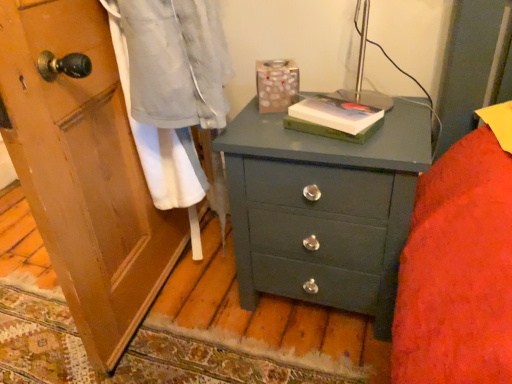
Question: Can you confirm if hardcover book at center, which is the 2th book from bottom to top, is positioned to the left of hardcover book at center, marked as the second book in a top-to-bottom arrangement?

Choices:
 (A) yes
 (B) no

Answer: (B)

Question: Can you see hardcover book at center, which is the 2th book from bottom to top, touching hardcover book at center, marked as the second book in a top-to-bottom arrangement?

Choices:
 (A) yes
 (B) no

Answer: (A)

Question: Is hardcover book at center, acting as the 1th book starting from the top, positioned with its back to hardcover book at center, marked as the 1th book in a bottom-to-top arrangement?

Choices:
 (A) no
 (B) yes

Answer: (A)

Question: Considering the relative sizes of hardcover book at center, acting as the 1th book starting from the top, and hardcover book at center, marked as the 1th book in a bottom-to-top arrangement, in the image provided, is hardcover book at center, acting as the 1th book starting from the top, smaller than hardcover book at center, marked as the 1th book in a bottom-to-top arrangement,?

Choices:
 (A) yes
 (B) no

Answer: (A)

Question: Is hardcover book at center, acting as the 1th book starting from the top, positioned behind hardcover book at center, marked as the 1th book in a bottom-to-top arrangement?

Choices:
 (A) yes
 (B) no

Answer: (B)

Question: Considering the positions of hardcover book at center, acting as the 1th book starting from the top, and matte green chest of drawers at center in the image, is hardcover book at center, acting as the 1th book starting from the top, taller or shorter than matte green chest of drawers at center?

Choices:
 (A) short
 (B) tall

Answer: (A)

Question: In the image, is hardcover book at center, which is the 2th book from bottom to top, positioned in front of or behind matte green chest of drawers at center?

Choices:
 (A) behind
 (B) front

Answer: (A)

Question: Does point (331, 114) appear closer or farther from the camera than point (386, 210)?

Choices:
 (A) closer
 (B) farther

Answer: (A)

Question: From the image's perspective, relative to matte green chest of drawers at center, is hardcover book at center, acting as the 1th book starting from the top, above or below?

Choices:
 (A) above
 (B) below

Answer: (A)

Question: From a real-world perspective, is matte green chest of drawers at center positioned above or below hardcover book at center, marked as the second book in a top-to-bottom arrangement?

Choices:
 (A) above
 (B) below

Answer: (B)

Question: Is matte green chest of drawers at center spatially inside hardcover book at center, marked as the second book in a top-to-bottom arrangement, or outside of it?

Choices:
 (A) outside
 (B) inside

Answer: (A)

Question: Considering the positions of matte green chest of drawers at center and hardcover book at center, marked as the second book in a top-to-bottom arrangement, in the image, is matte green chest of drawers at center wider or thinner than hardcover book at center, marked as the second book in a top-to-bottom arrangement,?

Choices:
 (A) wide
 (B) thin

Answer: (A)

Question: Considering the positions of point (232, 152) and point (366, 129), is point (232, 152) closer or farther from the camera than point (366, 129)?

Choices:
 (A) farther
 (B) closer

Answer: (A)

Question: Do you think hardcover book at center, marked as the second book in a top-to-bottom arrangement, is within hardcover book at center, which is the 2th book from bottom to top, or outside of it?

Choices:
 (A) inside
 (B) outside

Answer: (B)

Question: Is point (340, 137) positioned closer to the camera than point (304, 96)?

Choices:
 (A) closer
 (B) farther

Answer: (A)